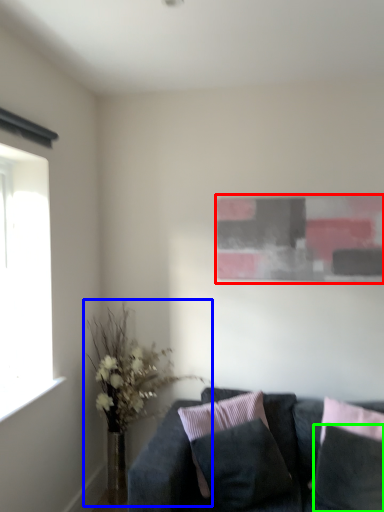
Question: Estimate the real-world distances between objects in this image. Which object is closer to picture frame (highlighted by a red box), houseplant (highlighted by a blue box) or pillow (highlighted by a green box)?

Choices:
 (A) houseplant
 (B) pillow

Answer: (A)